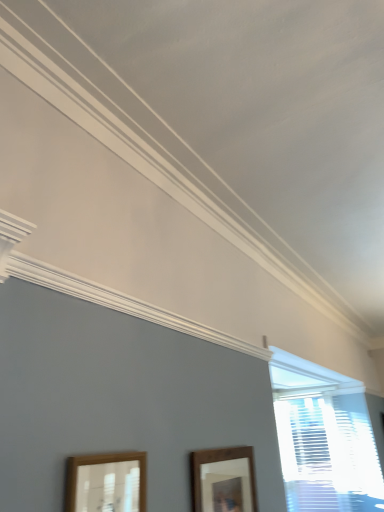
Question: Considering the positions of brown wooden picture frame at lower center, the 2th picture frame when ordered from left to right, and white textured blinds at right in the image, is brown wooden picture frame at lower center, the 2th picture frame when ordered from left to right, wider or thinner than white textured blinds at right?

Choices:
 (A) thin
 (B) wide

Answer: (A)

Question: From the image's perspective, relative to white textured blinds at right, is brown wooden picture frame at lower center, the 1th picture frame viewed from the right, above or below?

Choices:
 (A) above
 (B) below

Answer: (A)

Question: Based on their relative distances, which object is farther from the white textured blinds at right?

Choices:
 (A) wooden picture frame at lower left, which is counted as the 1th picture frame, starting from the front
 (B) brown wooden picture frame at lower center, the 1th picture frame viewed from the right

Answer: (A)

Question: Estimate the real-world distances between objects in this image. Which object is closer to the white textured blinds at right?

Choices:
 (A) wooden picture frame at lower left, the 2th picture frame in the back-to-front sequence
 (B) brown wooden picture frame at lower center, which ranks as the first picture frame in back-to-front order

Answer: (B)